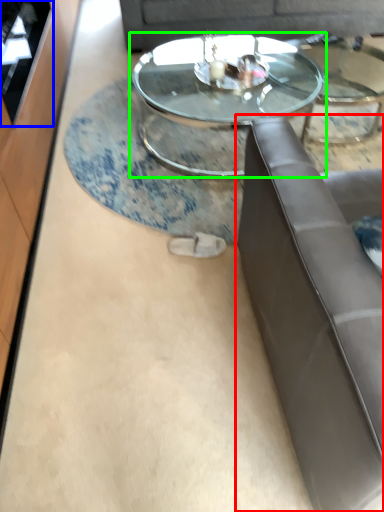
Question: Estimate the real-world distances between objects in this image. Which object is closer to studio couch (highlighted by a red box), glass door (highlighted by a blue box) or coffee table (highlighted by a green box)?

Choices:
 (A) glass door
 (B) coffee table

Answer: (B)